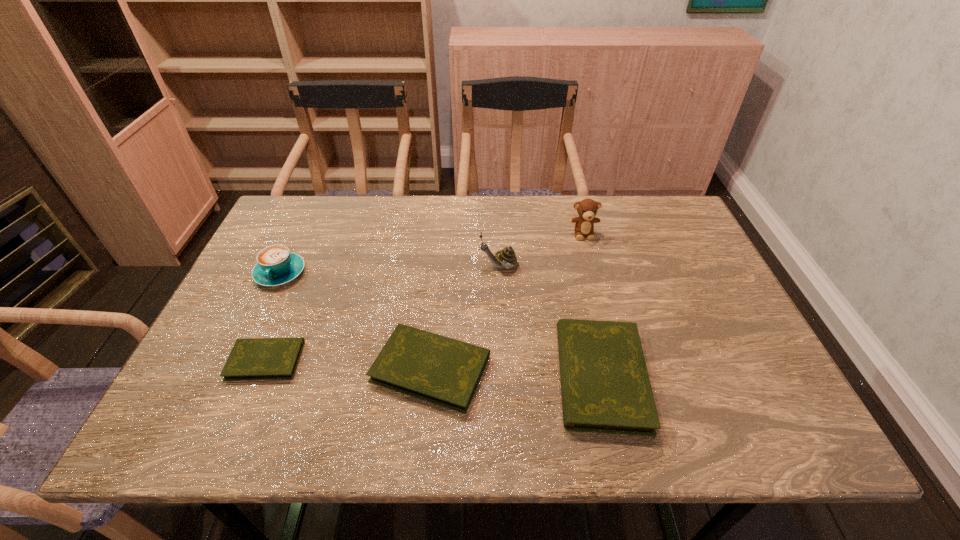
Identify the location of vacant space at the far edge of the desktop. (550, 241).

Identify the location of free location at the near edge of the desktop. (504, 396).

This screenshot has height=540, width=960. Identify the location of vacant region at the left edge. (228, 304).

The height and width of the screenshot is (540, 960). I want to click on blank area at the right edge, so click(661, 250).

This screenshot has height=540, width=960. In order to click on free point at the far left corner in this screenshot , I will do [x=291, y=213].

Locate an element on the screen. This screenshot has width=960, height=540. vacant space at the near left corner of the desktop is located at coordinates (195, 366).

What are the coordinates of `free space between the second tallest diary and the third tallest object` in the screenshot? It's located at (355, 321).

The width and height of the screenshot is (960, 540). I want to click on free space between the shortest object and the snail, so click(x=382, y=313).

Locate an element on the screen. The image size is (960, 540). unoccupied position between the fourth shortest object and the shortest object is located at coordinates click(273, 316).

Where is `unoccupied area between the second shortest diary and the snail`? The image size is (960, 540). unoccupied area between the second shortest diary and the snail is located at coordinates (465, 317).